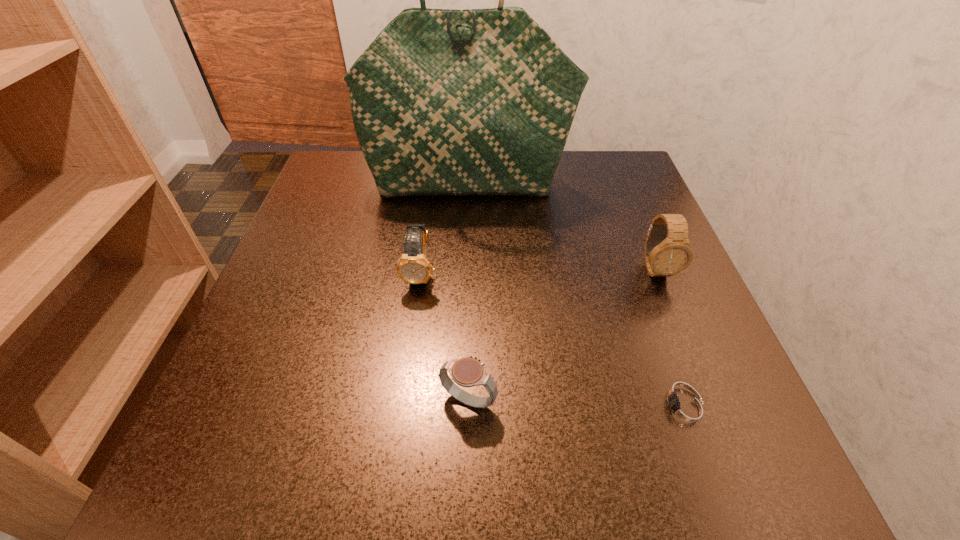
Identify the location of object present at the far right corner. (444, 102).

Where is `object that is positioned at the near right corner`? The image size is (960, 540). object that is positioned at the near right corner is located at coordinates (x=684, y=409).

At what (x,y) coordinates should I click in order to perform the action: click on free space at the near edge. Please return your answer as a coordinate pair (x, y). Image resolution: width=960 pixels, height=540 pixels. Looking at the image, I should click on (597, 491).

At what (x,y) coordinates should I click in order to perform the action: click on vacant point at the left edge. Please return your answer as a coordinate pair (x, y). This screenshot has width=960, height=540. Looking at the image, I should click on point(308,417).

You are a GUI agent. You are given a task and a screenshot of the screen. Output one action in this format:
    pyautogui.click(x=<x>, y=<y>)
    Task: Click on the vacant space at the right edge of the desktop
    This screenshot has height=540, width=960.
    Given the screenshot: What is the action you would take?
    pyautogui.click(x=606, y=245)

In the image, there is a desktop. Where is `vacant area at the far left corner`? Image resolution: width=960 pixels, height=540 pixels. vacant area at the far left corner is located at coordinates (360, 200).

In the image, there is a desktop. At what (x,y) coordinates should I click in order to perform the action: click on vacant space at the far right corner. Please return your answer as a coordinate pair (x, y). This screenshot has width=960, height=540. Looking at the image, I should click on (635, 170).

At what (x,y) coordinates should I click in order to perform the action: click on empty space that is in between the tote bag and the leftmost watch. Please return your answer as a coordinate pair (x, y). Looking at the image, I should click on (444, 229).

Identify the location of free space that is in between the third tallest watch and the tallest object. (468, 293).

In order to click on free space that is in between the third shortest object and the third watch from right to left in this screenshot , I will do `click(444, 337)`.